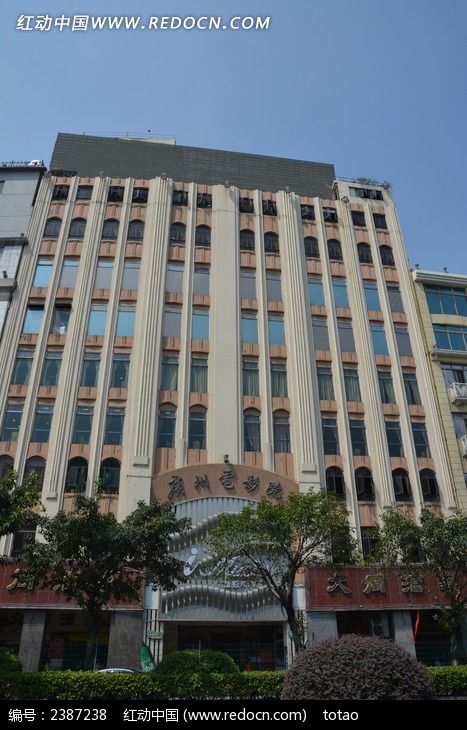
This screenshot has height=730, width=467. Find the location of `front entrance`. front entrance is located at coordinates (231, 645).